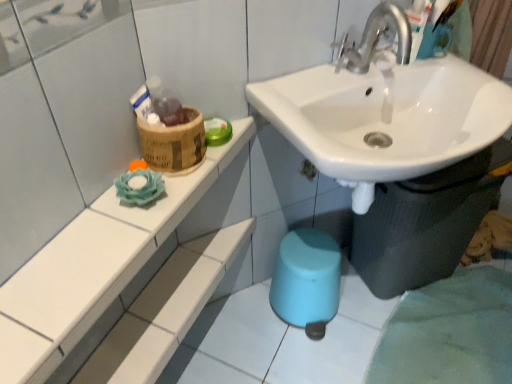
The image size is (512, 384). Find the location of `free space above white ceramic shelf at upper left (from a real-world perspective)`. free space above white ceramic shelf at upper left (from a real-world perspective) is located at coordinates click(106, 233).